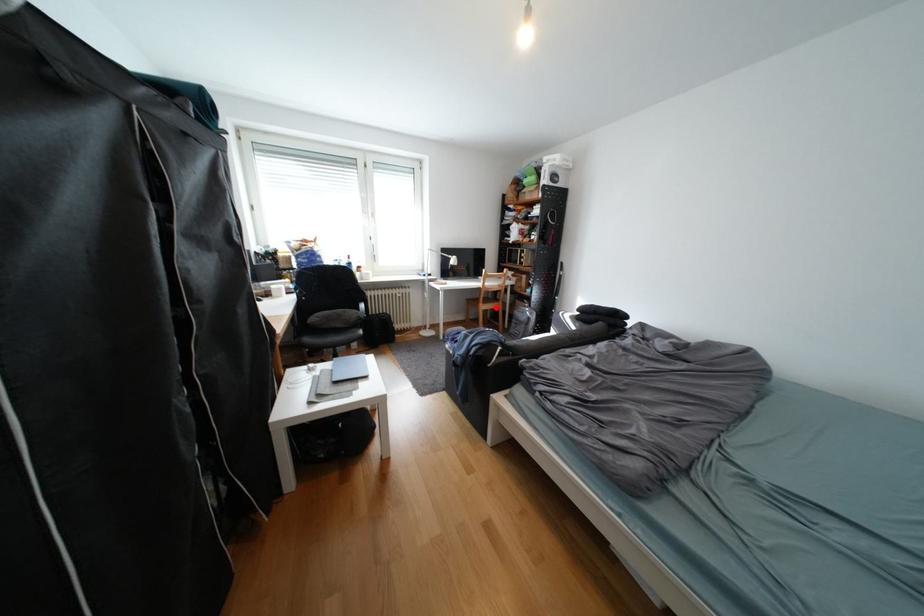
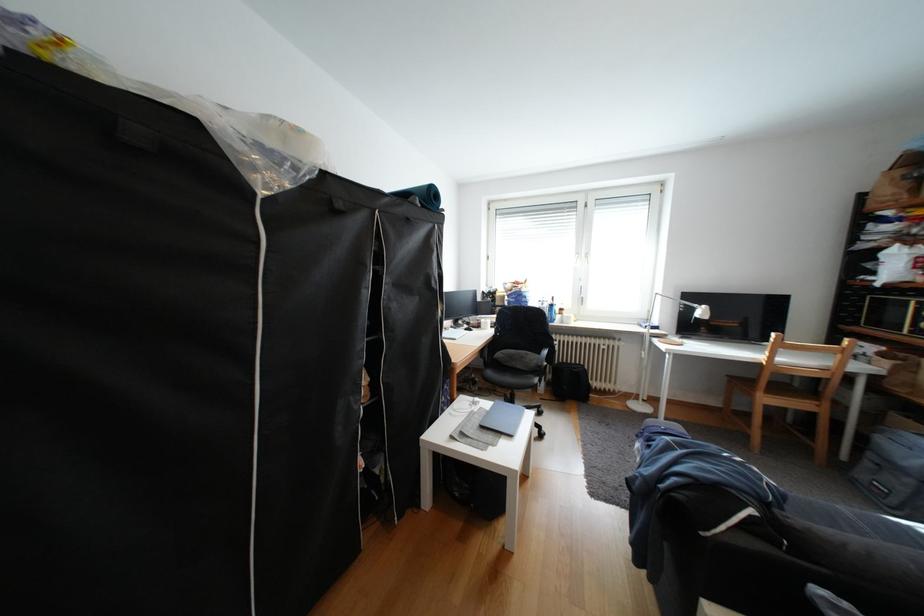
Where in the second image is the point corresponding to the highlighted location from the first image?

(779, 400)